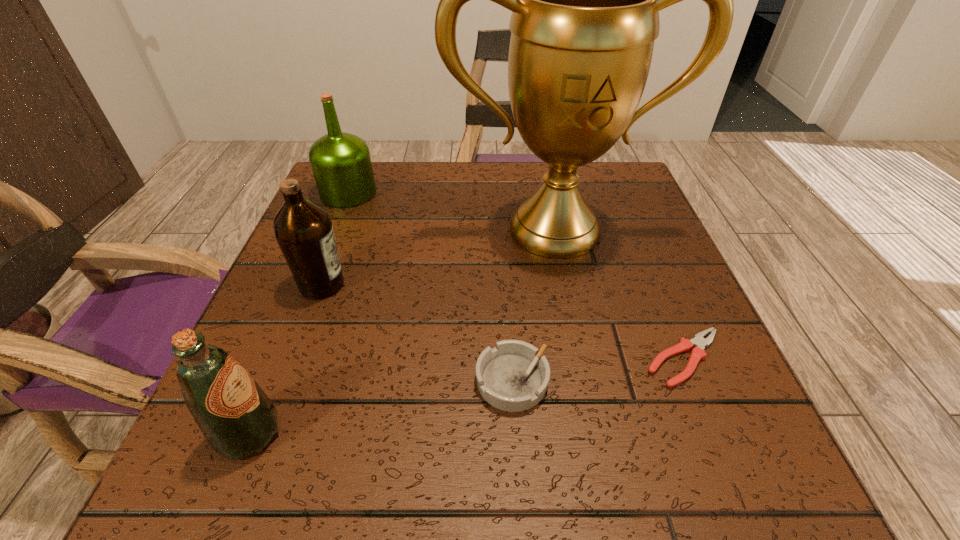
Identify the location of free spot that satisfies the following two spatial constraints: 1. on the surface of the trophy cup with symbols; 2. on the label of the third farthest object. (565, 285).

Where is `vacant space that satisfies the following two spatial constraints: 1. on the label of the fourth nearest object; 2. on the left side of the pliers`? The width and height of the screenshot is (960, 540). vacant space that satisfies the following two spatial constraints: 1. on the label of the fourth nearest object; 2. on the left side of the pliers is located at coordinates (294, 359).

Find the location of a particular element. The height and width of the screenshot is (540, 960). blank area in the image that satisfies the following two spatial constraints: 1. on the surface of the tallest object with symbols; 2. on the front-facing side of the nearest olive oil is located at coordinates (596, 433).

This screenshot has width=960, height=540. I want to click on vacant region that satisfies the following two spatial constraints: 1. on the surface of the tallest object with symbols; 2. on the right side of the shortest object, so tap(581, 359).

Locate an element on the screen. This screenshot has width=960, height=540. vacant region that satisfies the following two spatial constraints: 1. on the surface of the pliers with symbols; 2. on the left side of the trophy cup is located at coordinates (581, 359).